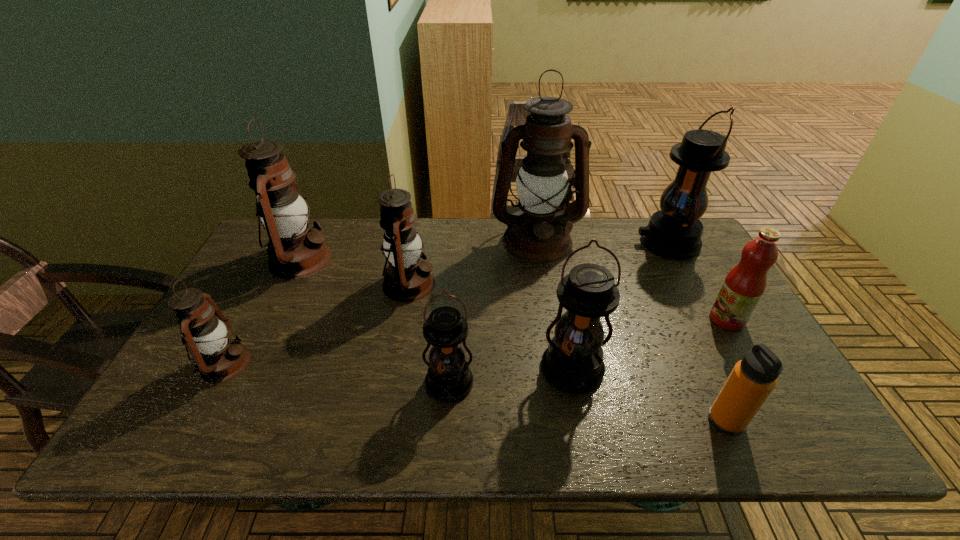
Find the location of `thermos bottle situated at the right edge`. thermos bottle situated at the right edge is located at coordinates (753, 378).

Where is `object situated at the far left corner`? Image resolution: width=960 pixels, height=540 pixels. object situated at the far left corner is located at coordinates (295, 251).

Identify the location of object situated at the far right corner. The width and height of the screenshot is (960, 540). (674, 232).

What are the coordinates of `object that is at the near right corner` in the screenshot? It's located at (753, 378).

Where is `free region at the far edge`? The image size is (960, 540). free region at the far edge is located at coordinates (345, 243).

Where is `free point at the near edge`? This screenshot has height=540, width=960. free point at the near edge is located at coordinates (659, 418).

Identify the location of blank space at the right edge of the desktop. (750, 346).

Find the location of a particular element. Image resolution: width=960 pixels, height=540 pixels. free space between the second biggest brown lantern and the third object from left to right is located at coordinates (354, 272).

This screenshot has width=960, height=540. Find the location of `free space that is in between the tallest object and the nearest brown lantern`. free space that is in between the tallest object and the nearest brown lantern is located at coordinates (381, 302).

Find the location of a particular element. The height and width of the screenshot is (540, 960). free space between the smallest black lantern and the nearest brown lantern is located at coordinates (338, 374).